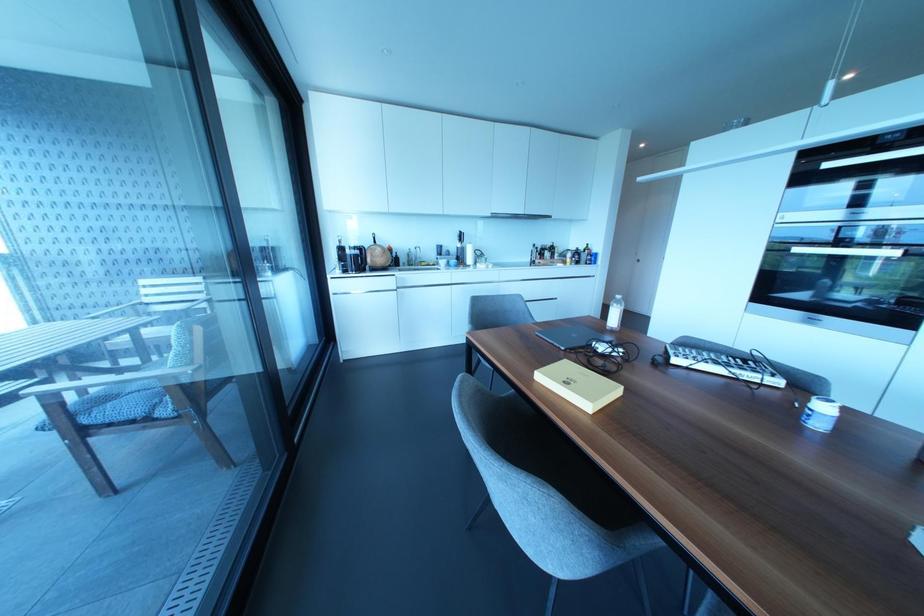
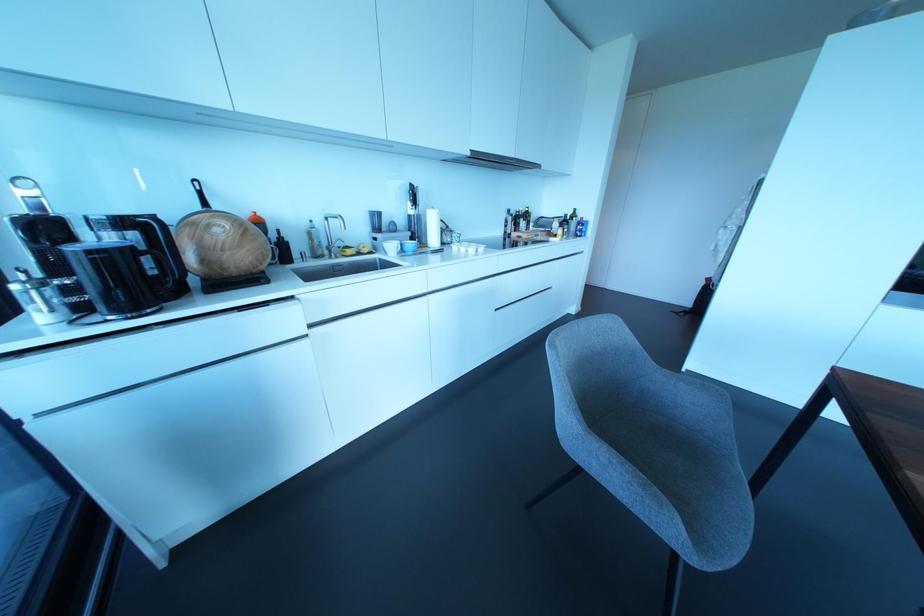
The point at (489, 265) is marked in the first image. Where is the corresponding point in the second image?

(480, 249)